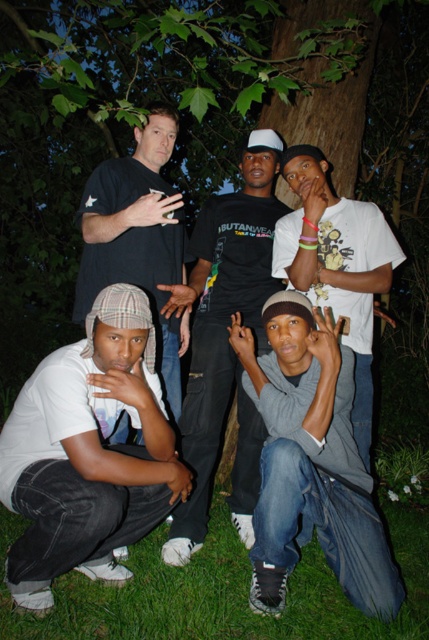
Question: Which of the following is the closest to the observer?

Choices:
 (A) green grass at lower center
 (B) white matte t-shirt at center
 (C) white cotton shirt at lower left

Answer: (C)

Question: Does green grass at lower center appear on the left side of matte black t-shirt at upper left?

Choices:
 (A) no
 (B) yes

Answer: (A)

Question: Does green grass at lower center have a smaller size compared to white matte t-shirt at center?

Choices:
 (A) no
 (B) yes

Answer: (A)

Question: Which of these objects is positioned closest to the matte black t-shirt at upper left?

Choices:
 (A) white matte t-shirt at center
 (B) gray cotton sweatshirt at lower center

Answer: (A)

Question: Can you confirm if black cotton t-shirt at center is wider than matte black t-shirt at upper left?

Choices:
 (A) yes
 (B) no

Answer: (A)

Question: Which of the following is the closest to the observer?

Choices:
 (A) white matte t-shirt at center
 (B) green grass at lower center
 (C) black cotton t-shirt at center

Answer: (B)